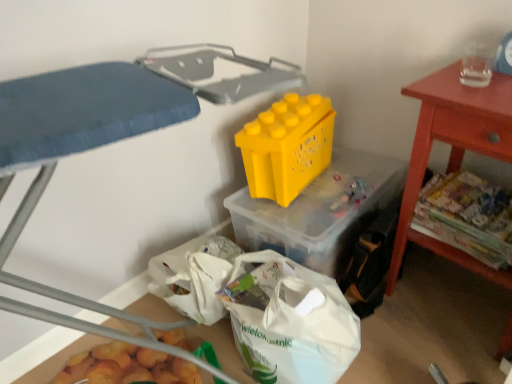
Question: Can you see yellow plastic storage box at center, positioned as the second storage box in bottom-to-top order, touching yellow plastic storage bin at upper center?

Choices:
 (A) yes
 (B) no

Answer: (B)

Question: Is yellow plastic storage box at center, placed as the second storage box when sorted from left to right, positioned behind yellow plastic storage bin at upper center?

Choices:
 (A) no
 (B) yes

Answer: (B)

Question: From a real-world perspective, is yellow plastic storage box at center, positioned as the second storage box in bottom-to-top order, on top of yellow plastic storage bin at upper center?

Choices:
 (A) no
 (B) yes

Answer: (A)

Question: Is yellow plastic storage bin at upper center at the back of yellow plastic storage box at center, which appears as the 1th storage box when viewed from the top?

Choices:
 (A) no
 (B) yes

Answer: (A)

Question: From a real-world perspective, is yellow plastic storage box at center, which is the 1th storage box in right-to-left order, physically below yellow plastic storage bin at upper center?

Choices:
 (A) no
 (B) yes

Answer: (B)

Question: Is point (453, 112) positioned closer to the camera than point (373, 218)?

Choices:
 (A) farther
 (B) closer

Answer: (B)

Question: From a real-world perspective, is smooth red table at right physically located above or below yellow plastic storage box at center, placed as the second storage box when sorted from left to right?

Choices:
 (A) below
 (B) above

Answer: (B)

Question: In terms of size, does smooth red table at right appear bigger or smaller than yellow plastic storage box at center, positioned as the second storage box in bottom-to-top order?

Choices:
 (A) small
 (B) big

Answer: (B)

Question: Considering the relative positions of smooth red table at right and yellow plastic storage box at center, which is the 1th storage box in right-to-left order, in the image provided, is smooth red table at right to the left or to the right of yellow plastic storage box at center, which is the 1th storage box in right-to-left order,?

Choices:
 (A) left
 (B) right

Answer: (B)

Question: Is yellow plastic storage bin at upper center spatially inside printed paper magazines at right, or outside of it?

Choices:
 (A) outside
 (B) inside

Answer: (A)

Question: Considering the positions of yellow plastic storage bin at upper center and printed paper magazines at right in the image, is yellow plastic storage bin at upper center taller or shorter than printed paper magazines at right?

Choices:
 (A) short
 (B) tall

Answer: (B)

Question: Considering the positions of point (159, 92) and point (509, 205), is point (159, 92) closer or farther from the camera than point (509, 205)?

Choices:
 (A) closer
 (B) farther

Answer: (A)

Question: Based on their sizes in the image, would you say yellow plastic storage bin at upper center is bigger or smaller than printed paper magazines at right?

Choices:
 (A) small
 (B) big

Answer: (B)

Question: Is smooth red table at right situated inside white plastic bag at lower center, marked as the 2th storage box in a top-to-bottom arrangement, or outside?

Choices:
 (A) inside
 (B) outside

Answer: (B)

Question: From a real-world perspective, is smooth red table at right physically located above or below white plastic bag at lower center, which appears as the first storage box when ordered from the bottom?

Choices:
 (A) above
 (B) below

Answer: (A)